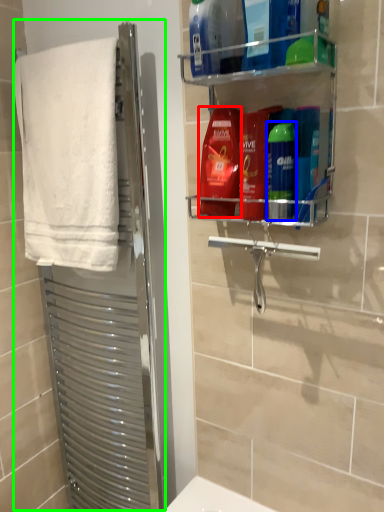
Question: Considering the real-world distances, which object is farthest from cleaning product (highlighted by a red box)? toiletry (highlighted by a blue box) or screen door (highlighted by a green box)?

Choices:
 (A) toiletry
 (B) screen door

Answer: (B)